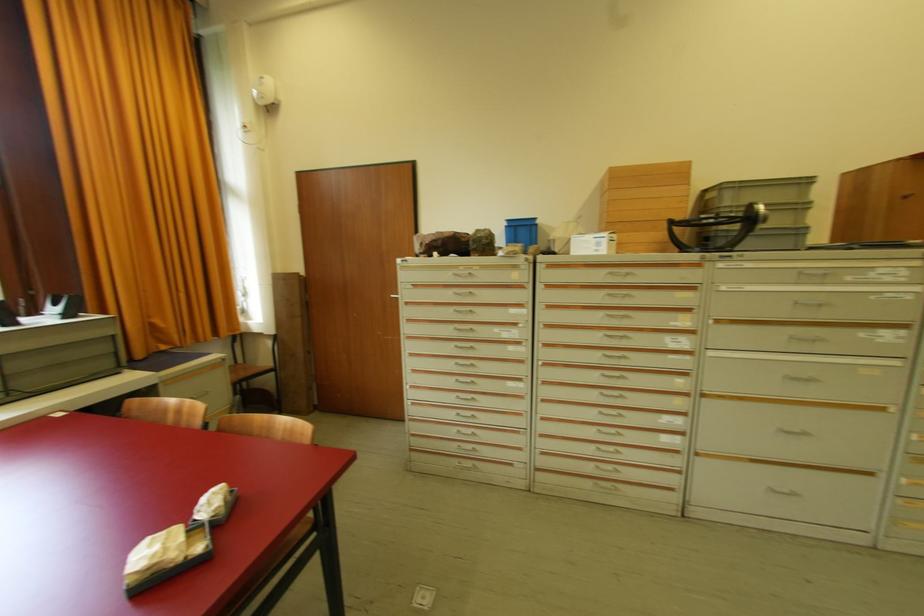
Find where to lift the grey plastic bin. Please return your answer as a coordinate pair (x, y).

(759, 211)